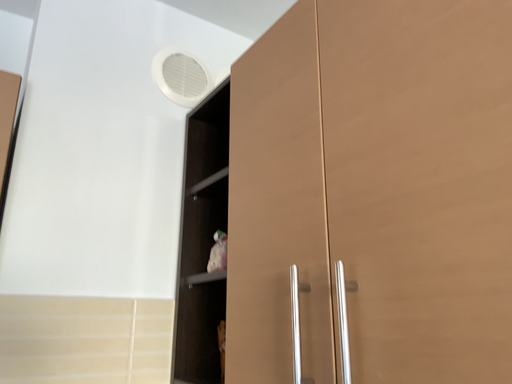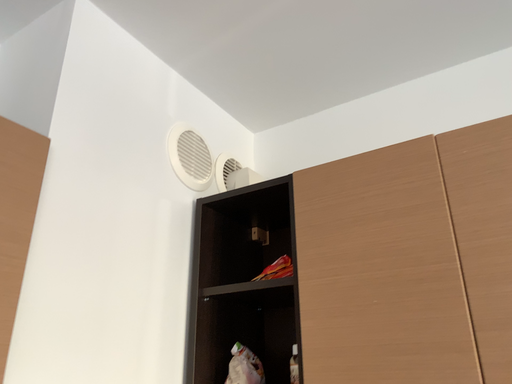
Question: How did the camera likely rotate when shooting the video?

Choices:
 (A) rotated right
 (B) rotated left

Answer: (A)